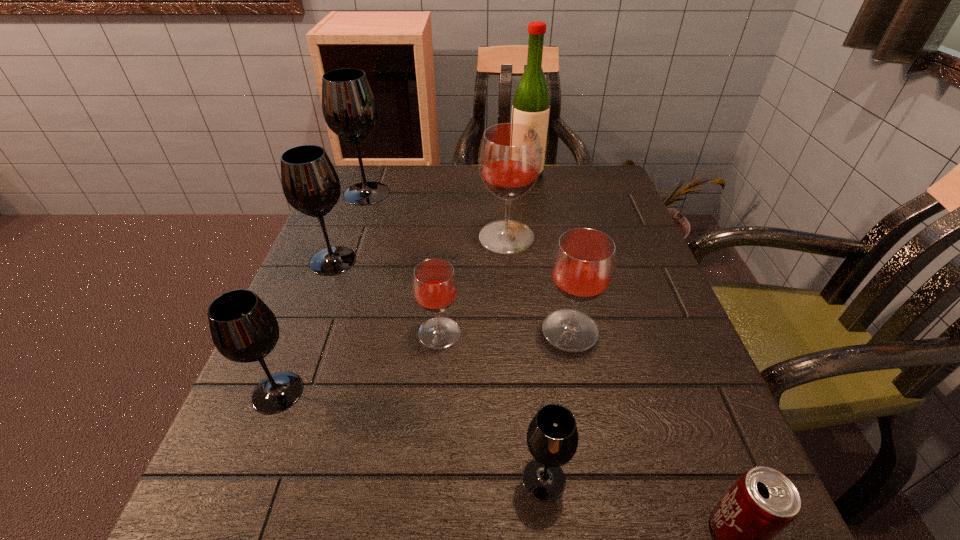
At what (x,y) coordinates should I click in order to perform the action: click on vacant area that lies between the farthest red wineglass and the third nearest object. Please return your answer as a coordinate pair (x, y). The width and height of the screenshot is (960, 540). Looking at the image, I should click on (392, 315).

Where is `object that stands as the eighth closest to the liquor`? This screenshot has height=540, width=960. object that stands as the eighth closest to the liquor is located at coordinates (762, 502).

You are a GUI agent. You are given a task and a screenshot of the screen. Output one action in this format:
    pyautogui.click(x=<x>, y=<y>)
    Task: Click on the object identified as the sixth closest to the farthest gray wineglass
    
    Given the screenshot: What is the action you would take?
    pyautogui.click(x=243, y=328)

You are a GUI agent. You are given a task and a screenshot of the screen. Output one action in this format:
    pyautogui.click(x=<x>, y=<y>)
    Task: Click on the wineglass that can be found as the fifth closest to the rightmost object
    The image size is (960, 540).
    Given the screenshot: What is the action you would take?
    pyautogui.click(x=243, y=328)

I want to click on wineglass that stands as the fourth closest to the third farthest gray wineglass, so click(x=583, y=265).

Identify which gray wineglass is located as the nearest to the seventh farthest object. Please provide its 2D coordinates. Your answer should be formatted as a tuple, i.e. [(x, y)], where the tuple contains the x and y coordinates of a point satisfying the conditions above.

[(310, 183)]

Locate an element on the screen. This screenshot has width=960, height=540. gray wineglass that is the third closest one to the biggest red wineglass is located at coordinates (243, 328).

Select which red wineglass appears as the third closest to the third nearest gray wineglass. Please provide its 2D coordinates. Your answer should be formatted as a tuple, i.e. [(x, y)], where the tuple contains the x and y coordinates of a point satisfying the conditions above.

[(583, 265)]

This screenshot has width=960, height=540. What are the coordinates of `red wineglass that is the second nearest to the leftmost red wineglass` in the screenshot? It's located at (510, 155).

This screenshot has height=540, width=960. What are the coordinates of `free point that satisfies the following two spatial constraints: 1. on the label of the green liquor; 2. on the left side of the second smallest red wineglass` in the screenshot? It's located at (551, 330).